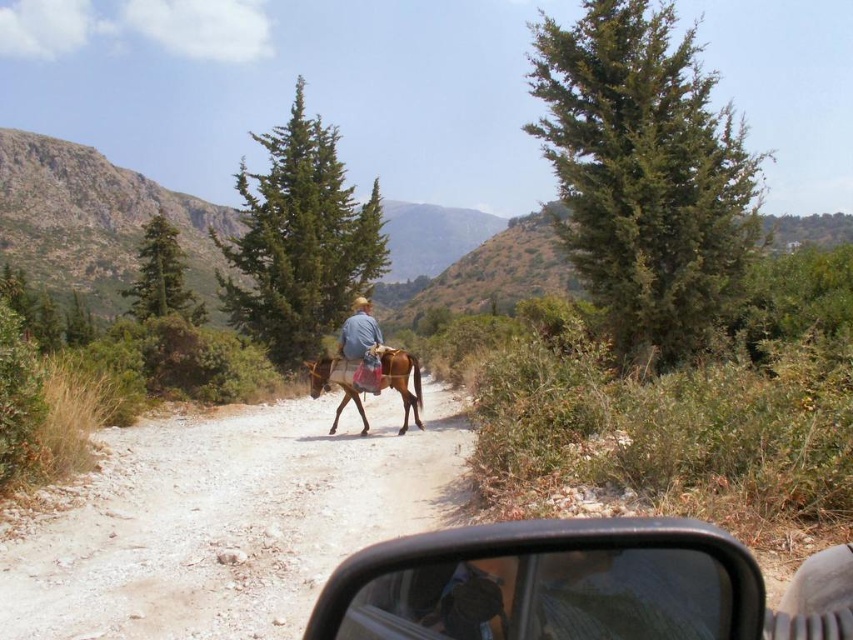
You are driving a car and see the green textured pine at upper left and the brown glossy horse at center. Which object is closer to your car?

The brown glossy horse at center is closer to your car than the green textured pine at upper left, since it is only 19.14 meters away from the horse.

You are driving on a rural path and notice the brown gravel road at center and the green textured pine at upper left. Which object takes up more space in the scene?

The green textured pine at upper left occupies more space than the brown gravel road at center.

You are driving a car and see the point marked at coordinates (161,276). What is the object at that location?

The point at (161,276) indicates green textured pine at upper left.